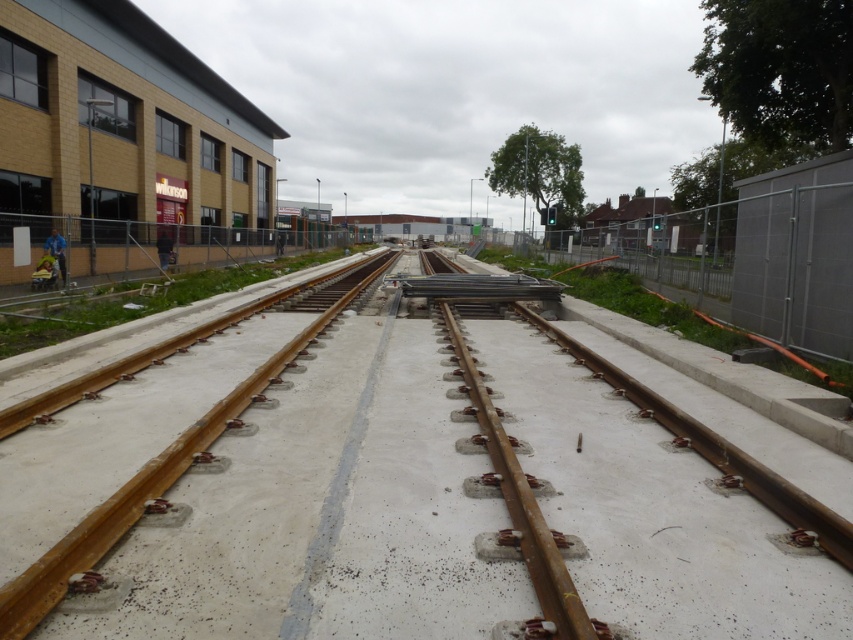
Question: Can you confirm if rusty metal train track at center is positioned above rusty metal train track at left?

Choices:
 (A) yes
 (B) no

Answer: (B)

Question: Is rusty metal train track at center further to the viewer compared to rusty metal train track at left?

Choices:
 (A) no
 (B) yes

Answer: (A)

Question: Among these points, which one is nearest to the camera?

Choices:
 (A) pos(83,540)
 (B) pos(30,502)

Answer: (A)

Question: Is rusty metal train track at center to the right of rusty metal train track at left from the viewer's perspective?

Choices:
 (A) no
 (B) yes

Answer: (B)